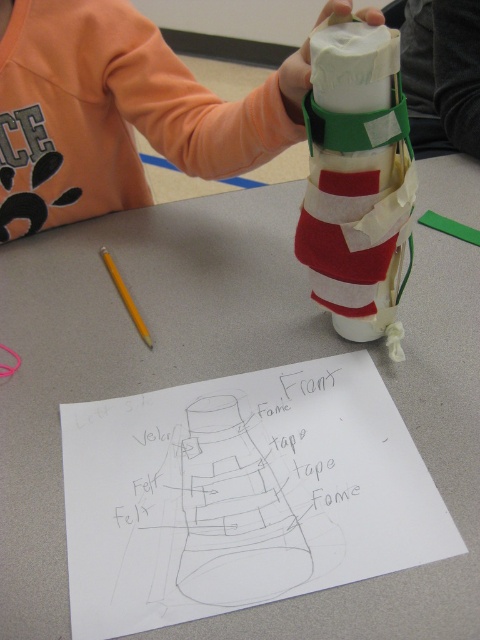
Question: Which point is farther to the camera?

Choices:
 (A) yellow wood pencil at left
 (B) white matte paper towel roll at center

Answer: (A)

Question: Observing the image, what is the correct spatial positioning of white matte paper towel roll at center in reference to matte felt wrapped cylinder at center?

Choices:
 (A) right
 (B) left

Answer: (B)

Question: Which of these objects is positioned closest to the yellow wood pencil at left?

Choices:
 (A) matte felt wrapped cylinder at center
 (B) white matte paper towel roll at center

Answer: (B)

Question: Is white matte paper towel roll at center thinner than yellow wood pencil at left?

Choices:
 (A) yes
 (B) no

Answer: (B)

Question: Estimate the real-world distances between objects in this image. Which object is closer to the matte felt wrapped cylinder at center?

Choices:
 (A) white matte paper towel roll at center
 (B) yellow wood pencil at left

Answer: (A)

Question: Can you confirm if white matte paper towel roll at center is thinner than yellow wood pencil at left?

Choices:
 (A) no
 (B) yes

Answer: (A)